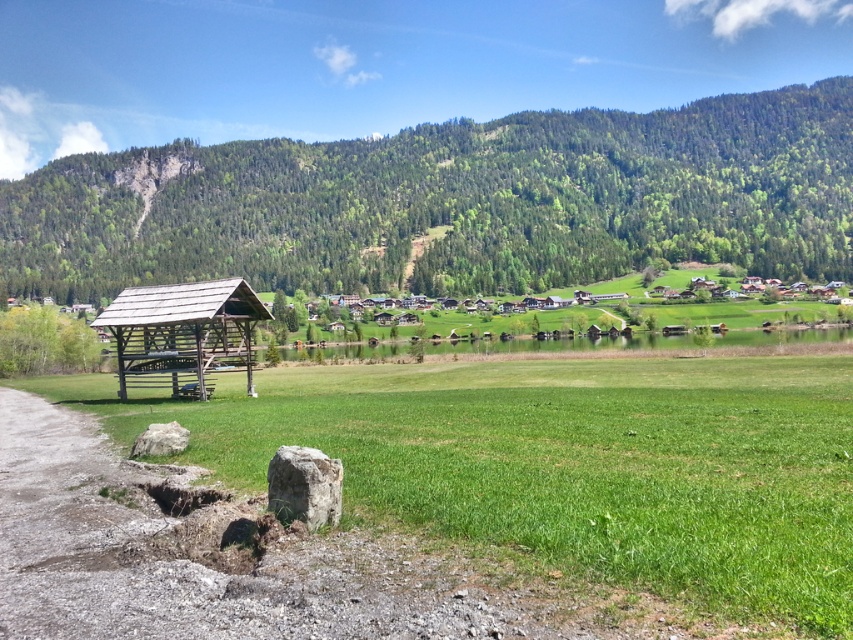
Question: Does green grassy field at center appear over wooden shed at left?

Choices:
 (A) no
 (B) yes

Answer: (A)

Question: Is green grassy field at center positioned before wooden shed at left?

Choices:
 (A) yes
 (B) no

Answer: (A)

Question: Can you confirm if green forested mountain at upper center is positioned to the left of green grassy field at center?

Choices:
 (A) yes
 (B) no

Answer: (B)

Question: Which of these objects is positioned farthest from the green grassy field at center?

Choices:
 (A) wooden shed at left
 (B) green forested mountain at upper center

Answer: (B)

Question: Which of these objects is positioned farthest from the green forested mountain at upper center?

Choices:
 (A) green grassy field at center
 (B) wooden shed at left

Answer: (B)

Question: Which of the following is the closest to the observer?

Choices:
 (A) green grassy field at center
 (B) wooden shed at left
 (C) green forested mountain at upper center

Answer: (A)